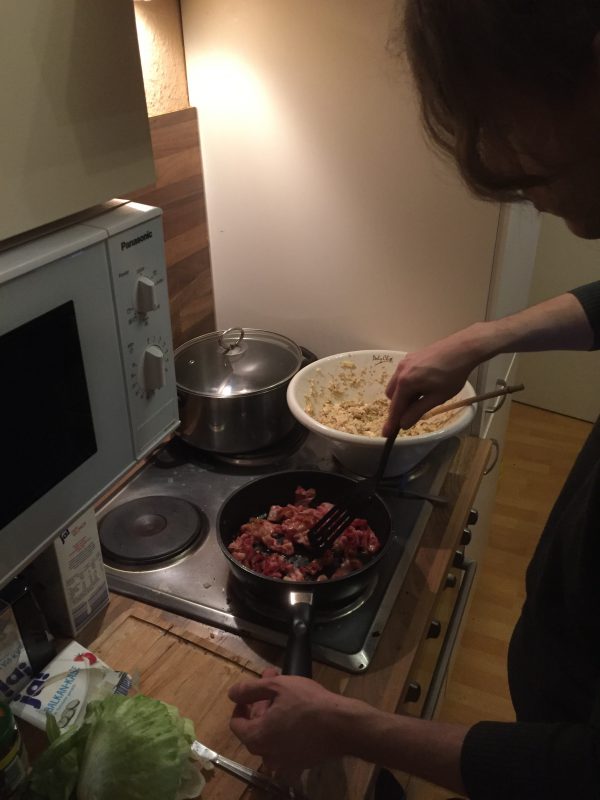
At what (x,y) coordinates should I click in order to perform the action: click on wood backsplash. Please return your answer as a coordinate pair (x, y). Looking at the image, I should click on (181, 202).